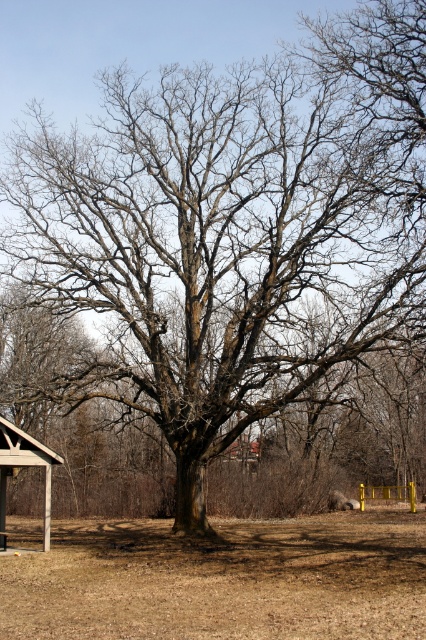
You are planning to set up a small garden in the brown dry soil at center near the wooden picnic table at lower left. Considering their sizes, which area would be more suitable for planting flowers?

The brown dry soil at center is bigger than the wooden picnic table at lower left, so the brown dry soil at center would be more suitable for planting flowers as it provides a larger space.

You are planning to set up a tent for a camping trip and have arrived at the location shown in the image. You see the brown dry soil at center and the wooden picnic table at lower left. Which location would be more suitable for setting up your tent, and why?

The brown dry soil at center is more suitable for setting up the tent because it is in front of the wooden picnic table at lower left, making it a more open and accessible area compared to the area near the picnic table.

You are a gardener planning to plant a new sapling in the park. You see the brown dry soil at center. Based on its location, can you determine if this spot is suitable for planting the sapling?

The brown dry soil at center is located at point (x=218, y=579). Since the soil is dry and brown, it may not be suitable for planting the sapling as dry soil can indicate poor moisture retention and potential nutrient deficiencies.